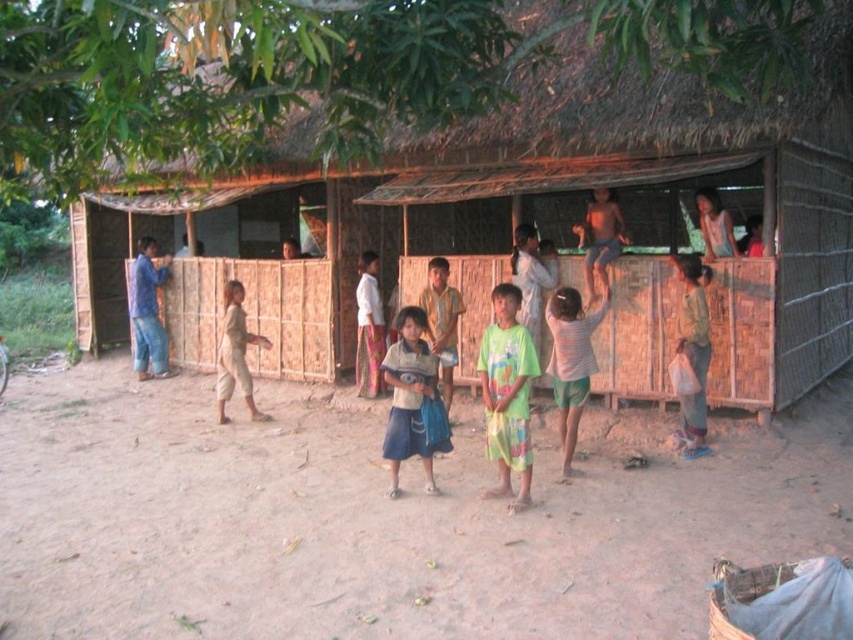
Based on the photo, you are a visitor to this rural area and want to hang a small decoration between the light brown woven cloth at center and the light brown wooden pole at upper right. Based on their positions, which object is closer to the front of the hut where you are standing?

The light brown woven cloth at center is closer to the front of the hut than the light brown wooden pole at upper right.